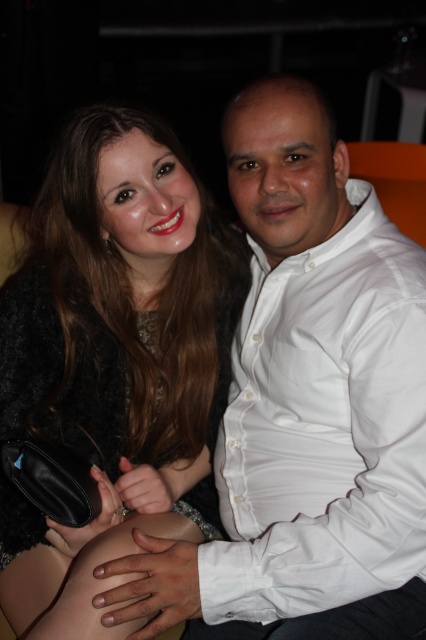
Does shiny black dress at center have a lesser width compared to white cotton shirt at right?

No, shiny black dress at center is not thinner than white cotton shirt at right.

Does shiny black dress at center have a greater width compared to white cotton shirt at right?

Indeed, shiny black dress at center has a greater width compared to white cotton shirt at right.

Who is more distant from viewer, (25,413) or (307,595)?

Positioned behind is point (25,413).

Image resolution: width=426 pixels, height=640 pixels. Identify the location of shiny black dress at center. (112, 355).